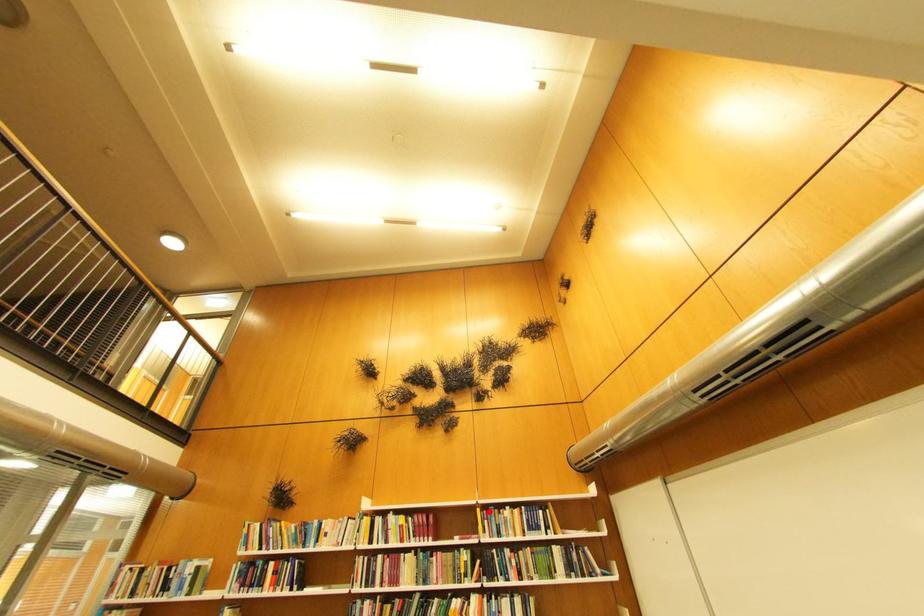
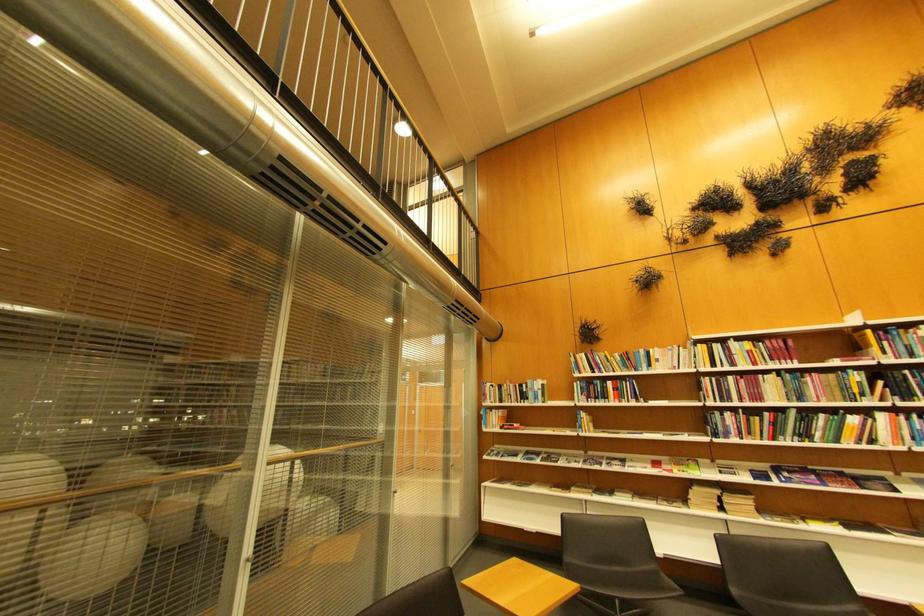
Locate, in the second image, the point that corresponds to the highlighted location in the first image.

(880, 333)